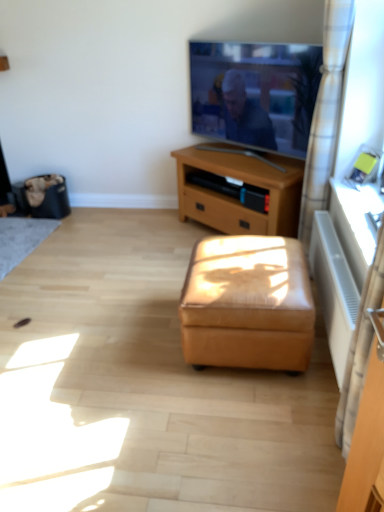
This screenshot has width=384, height=512. What do you see at coordinates (255, 93) in the screenshot? I see `matte black tv at upper center` at bounding box center [255, 93].

Where is `matte black tv at upper center`? matte black tv at upper center is located at coordinates (255, 93).

Locate an element on the screen. The height and width of the screenshot is (512, 384). metallic silver radiator at right is located at coordinates (355, 223).

The width and height of the screenshot is (384, 512). What are the coordinates of `leather ottoman at center` in the screenshot? It's located at [247, 304].

Measure the distance between leather ottoman at center and camera.

5.69 feet.

Locate an element on the screen. The image size is (384, 512). white checkered curtain at right is located at coordinates (325, 114).

Can you confirm if matte black tv at upper center is smaller than leather ottoman at center?

Yes.

Considering the points (232, 61) and (288, 306), which point is behind, point (232, 61) or point (288, 306)?

Positioned behind is point (232, 61).

From the image's perspective, is matte black tv at upper center located beneath leather ottoman at center?

No.

Is point (341, 229) closer or farther from the camera than point (213, 204)?

Point (341, 229).

Can you confirm if metallic silver radiator at right is thinner than brown wooden tv stand at center?

Yes.

Measure the distance from metallic silver radiator at right to brown wooden tv stand at center.

A distance of 73.90 centimeters exists between metallic silver radiator at right and brown wooden tv stand at center.

Consider the image. Which of these two, metallic silver radiator at right or brown wooden tv stand at center, stands taller?

With more height is brown wooden tv stand at center.

Based on their sizes in the image, would you say black fabric trash bin at left is bigger or smaller than white checkered curtain at right?

Clearly, black fabric trash bin at left is smaller in size than white checkered curtain at right.

From the image's perspective, is black fabric trash bin at left under white checkered curtain at right?

Yes, from the image's perspective, black fabric trash bin at left is below white checkered curtain at right.

Between black fabric trash bin at left and white checkered curtain at right, which one appears on the right side from the viewer's perspective?

white checkered curtain at right is more to the right.

Does metallic silver radiator at right have a lesser width compared to leather ottoman at center?

Yes, metallic silver radiator at right is thinner than leather ottoman at center.

Is metallic silver radiator at right completely or partially outside of leather ottoman at center?

metallic silver radiator at right lies outside leather ottoman at center's area.

From the image's perspective, is metallic silver radiator at right on top of leather ottoman at center?

Yes, from the image's perspective, metallic silver radiator at right is on top of leather ottoman at center.

In the image, is metallic silver radiator at right on the left side or the right side of leather ottoman at center?

Clearly, metallic silver radiator at right is on the right of leather ottoman at center in the image.

Is black fabric trash bin at left taller or shorter than leather ottoman at center?

Clearly, black fabric trash bin at left is shorter compared to leather ottoman at center.

Where is `trash bin/can above the leather ottoman at center (from the image's perspective)`? trash bin/can above the leather ottoman at center (from the image's perspective) is located at coordinates 43,196.

From a real-world perspective, is black fabric trash bin at left physically located above or below leather ottoman at center?

black fabric trash bin at left is below leather ottoman at center.

From the picture: Is leather ottoman at center positioned beyond the bounds of black fabric trash bin at left?

That's correct, leather ottoman at center is outside of black fabric trash bin at left.

Locate an element on the screen. stool lying below the black fabric trash bin at left (from the image's perspective) is located at coordinates (247, 304).

Can you tell me how much leather ottoman at center and black fabric trash bin at left differ in facing direction?

There is a 87.2-degree angle between the facing directions of leather ottoman at center and black fabric trash bin at left.

In the image, is leather ottoman at center on the left side or the right side of black fabric trash bin at left?

leather ottoman at center is to the right of black fabric trash bin at left.

Is metallic silver radiator at right to the left of matte black tv at upper center from the viewer's perspective?

No.

Is metallic silver radiator at right facing towards matte black tv at upper center?

No, metallic silver radiator at right is not facing towards matte black tv at upper center.

Is metallic silver radiator at right shorter than matte black tv at upper center?

Correct, metallic silver radiator at right is not as tall as matte black tv at upper center.

You are a GUI agent. You are given a task and a screenshot of the screen. Output one action in this format:
    pyautogui.click(x=<x>, y=<y>)
    Task: Click on the television that appears above the leather ottoman at center (from a real-world perspective)
    
    Given the screenshot: What is the action you would take?
    pyautogui.click(x=255, y=93)

At what (x,y) coordinates should I click in order to perform the action: click on table lying below the brown wooden tv stand at center (from the image's perspective). Please return your answer as a coordinate pair (x, y). This screenshot has height=512, width=384. Looking at the image, I should click on (355, 223).

When comparing their distances from black fabric trash bin at left, does brown wooden tv stand at center or metallic silver radiator at right seem further?

Based on the image, metallic silver radiator at right appears to be further to black fabric trash bin at left.

Estimate the real-world distances between objects in this image. Which object is further from leather ottoman at center, brown wooden tv stand at center or black fabric trash bin at left?

black fabric trash bin at left is positioned further to the anchor leather ottoman at center.

Considering their positions, is white checkered curtain at right positioned further to metallic silver radiator at right than leather ottoman at center?

leather ottoman at center lies further to metallic silver radiator at right than the other object.

Looking at the image, which one is located closer to matte black tv at upper center, brown wooden tv stand at center or metallic silver radiator at right?

brown wooden tv stand at center is closer to matte black tv at upper center.

From the image, which object appears to be farther from matte black tv at upper center, brown wooden tv stand at center or leather ottoman at center?

The object further to matte black tv at upper center is leather ottoman at center.

Estimate the real-world distances between objects in this image. Which object is closer to black fabric trash bin at left, matte black tv at upper center or brown wooden tv stand at center?

Based on the image, brown wooden tv stand at center appears to be nearer to black fabric trash bin at left.

When comparing their distances from metallic silver radiator at right, does brown wooden tv stand at center or leather ottoman at center seem further?

Among the two, brown wooden tv stand at center is located further to metallic silver radiator at right.

Considering their positions, is brown wooden tv stand at center positioned further to metallic silver radiator at right than white checkered curtain at right?

brown wooden tv stand at center is further to metallic silver radiator at right.

I want to click on television between white checkered curtain at right and brown wooden tv stand at center in the front-back direction, so click(x=255, y=93).

This screenshot has width=384, height=512. Find the location of `curtain positioned between leather ottoman at center and brown wooden tv stand at center from near to far`. curtain positioned between leather ottoman at center and brown wooden tv stand at center from near to far is located at coordinates (325, 114).

Find the location of `curtain between matte black tv at upper center and leather ottoman at center from top to bottom`. curtain between matte black tv at upper center and leather ottoman at center from top to bottom is located at coordinates [325, 114].

The image size is (384, 512). What are the coordinates of `stool between metallic silver radiator at right and brown wooden tv stand at center from front to back` in the screenshot? It's located at coord(247,304).